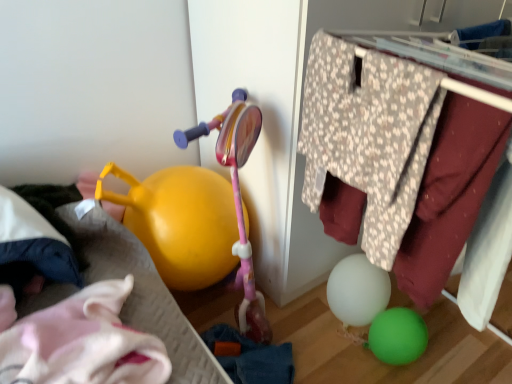
Question: Relative to yellow plastic watering can at left, is floral fabric clothes hanger at upper right in front or behind?

Choices:
 (A) behind
 (B) front

Answer: (B)

Question: Would you say floral fabric clothes hanger at upper right is to the left or to the right of yellow plastic watering can at left in the picture?

Choices:
 (A) left
 (B) right

Answer: (B)

Question: Estimate the real-world distances between objects in this image. Which object is closer to the white soft pillow at left?

Choices:
 (A) floral fabric clothes hanger at upper right
 (B) yellow plastic watering can at left

Answer: (B)

Question: Estimate the real-world distances between objects in this image. Which object is farther from the floral fabric clothes hanger at upper right?

Choices:
 (A) white soft pillow at left
 (B) yellow plastic watering can at left

Answer: (A)